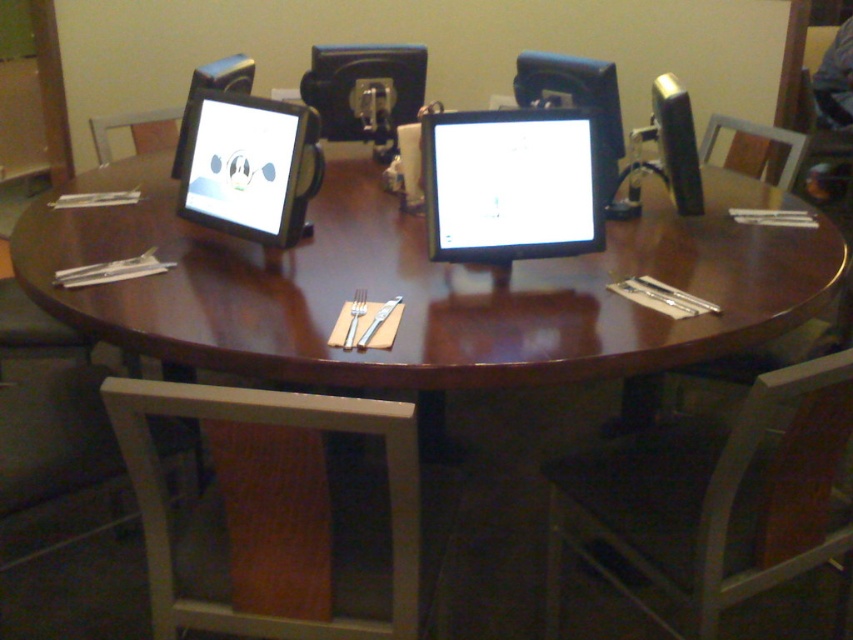
You are sitting in the white plastic swivel chair at lower left and want to look at the white glossy monitor at center. Which direction should you turn your head to see it?

The white plastic swivel chair at lower left is located below the white glossy monitor at center, so you should look upward to see the white glossy monitor at center.

You are planning to place a large decorative plant in the middle of the table. Considering the white plastic swivel chair at lower left and the white glossy monitor at center, which object is bigger in size?

The white plastic swivel chair at lower left is larger in size compared to the white glossy monitor at center, so the chair is bigger.

You are organizing a small event and need to seat guests comfortably. You have a space that can only accommodate chairs with a width of 60 cm or less. Based on the image, can the white plastic swivel chair at lower left and the wooden chair at upper right both fit in this space?

Result: The white plastic swivel chair at lower left has a larger width than the wooden chair at upper right. Since the space can only accommodate chairs with a width of 60 cm or less, we need to know the exact widths. However, the description only states the relative sizes. Without specific measurements, we cannot definitively determine if both chairs will fit. Please provide the exact widths for an accurate assessment.